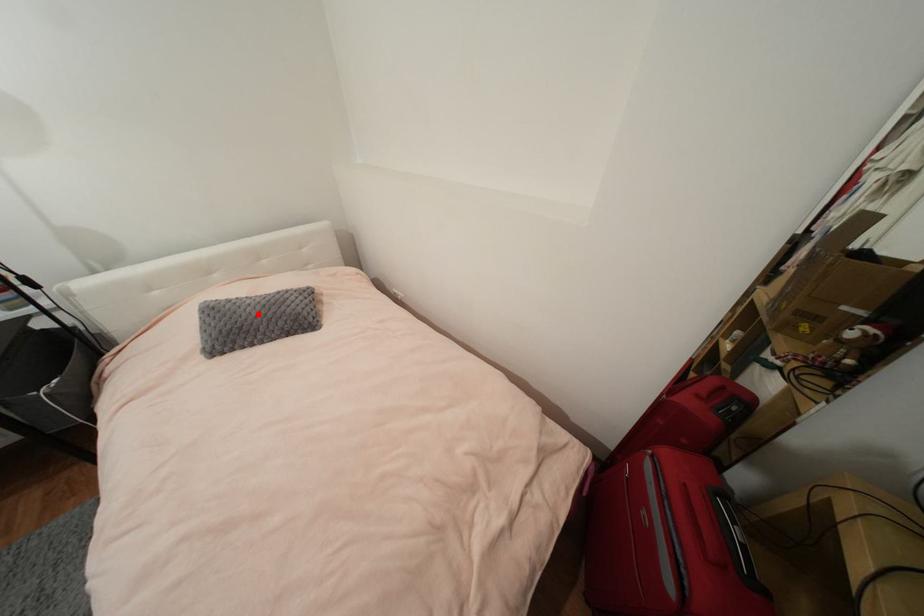
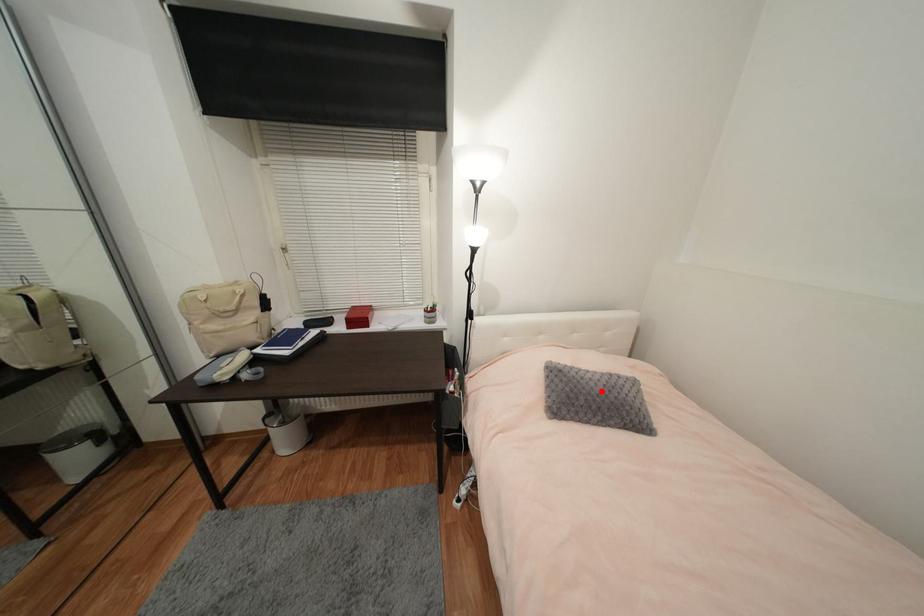
I am providing you with two images of the same scene from different viewpoints. A red point is marked on the first image and another point is marked on the second image. Are the points marked in image1 and image2 representing the same 3D position?

Yes